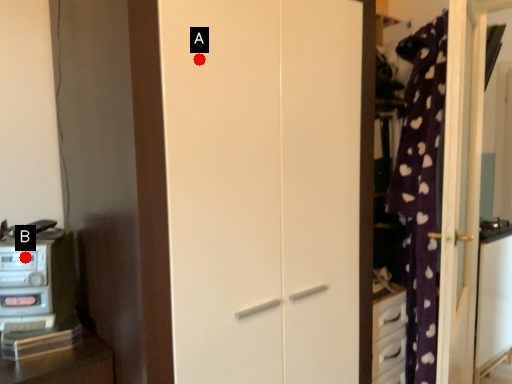
Question: Two points are circled on the image, labeled by A and B beside each circle. Which of the following is the farthest from the observer?

Choices:
 (A) A is further
 (B) B is further

Answer: (B)